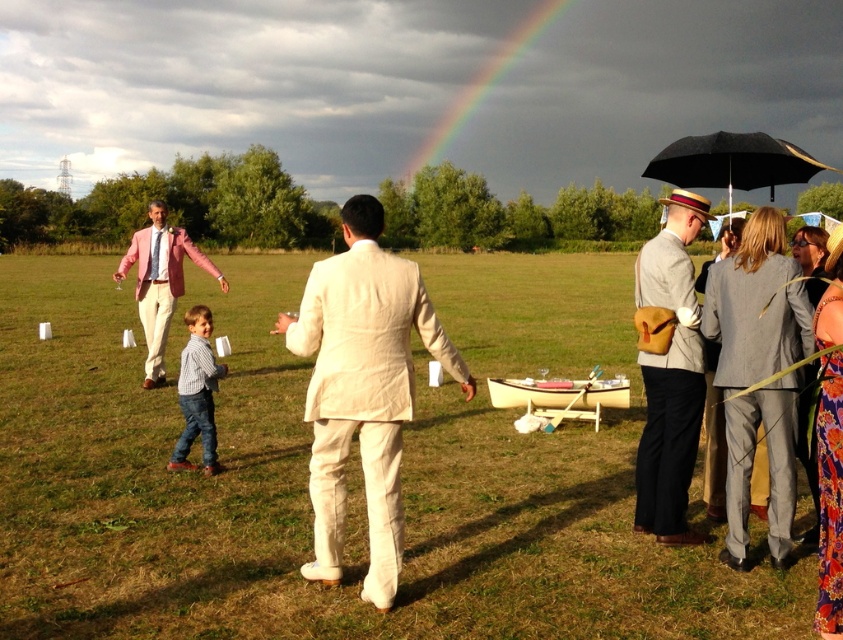
Question: Which of the following is the farthest from the observer?

Choices:
 (A) light beige suit at center
 (B) light gray wool suit at right
 (C) black matte umbrella at upper right

Answer: (C)

Question: Which of the following is the closest to the observer?

Choices:
 (A) (658, 426)
 (B) (750, 176)
 (C) (183, 237)

Answer: (A)

Question: Does pink linen suit at left appear on the left side of beige wooden canoe at lower center?

Choices:
 (A) no
 (B) yes

Answer: (B)

Question: Among these objects, which one is farthest from the camera?

Choices:
 (A) striped shirt at center
 (B) light gray wool suit at right
 (C) light beige suit at center
 (D) pink linen suit at left

Answer: (D)

Question: Does light beige suit at center have a greater width compared to pink linen suit at left?

Choices:
 (A) yes
 (B) no

Answer: (A)

Question: Is pink linen suit at left below rainbow at upper center?

Choices:
 (A) yes
 (B) no

Answer: (A)